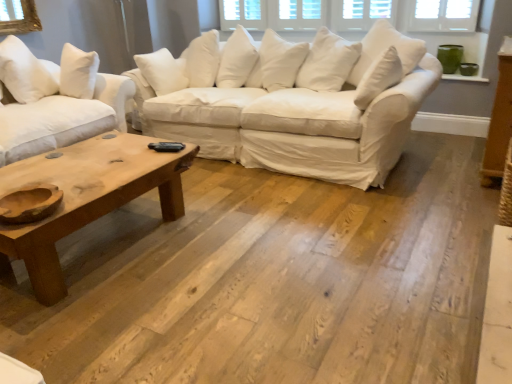
In order to face natural wood studio couch at left, which appears as the first studio couch when viewed from the left, should I rotate leftwards or rightwards?

It's best to rotate left around 27.192 degrees.

Identify the location of natural wood studio couch at left, which appears as the first studio couch when viewed from the left. This screenshot has width=512, height=384. (56, 100).

In order to click on white cotton pillow at upper left in this screenshot , I will do `click(26, 72)`.

Identify the location of natural wood studio couch at left, which appears as the first studio couch when viewed from the left. (56, 100).

Is natural wood studio couch at left, which appears as the first studio couch when viewed from the left, situated inside white cotton pillow at upper left or outside?

natural wood studio couch at left, which appears as the first studio couch when viewed from the left, lies outside white cotton pillow at upper left.

Looking at this image, are natural wood studio couch at left, positioned as the second studio couch in right-to-left order, and white cotton pillow at upper left far apart?

No, there isn't a large distance between natural wood studio couch at left, positioned as the second studio couch in right-to-left order, and white cotton pillow at upper left.

Which point is more forward, (41, 103) or (11, 43)?

The point (11, 43) is in front.

Is the depth of natural wood studio couch at left, which appears as the first studio couch when viewed from the left, greater than that of white cotton pillow at upper left?

No, natural wood studio couch at left, which appears as the first studio couch when viewed from the left, is in front of white cotton pillow at upper left.

Measure the distance from natural wood studio couch at left, which appears as the first studio couch when viewed from the left, to white cotton couch at center, acting as the 1th studio couch starting from the right.

natural wood studio couch at left, which appears as the first studio couch when viewed from the left, is 37.60 inches from white cotton couch at center, acting as the 1th studio couch starting from the right.

Which is in front, point (106, 113) or point (386, 22)?

Positioned in front is point (106, 113).

Are natural wood studio couch at left, positioned as the second studio couch in right-to-left order, and white cotton couch at center, acting as the 1th studio couch starting from the right, far apart?

No, there isn't a large distance between natural wood studio couch at left, positioned as the second studio couch in right-to-left order, and white cotton couch at center, acting as the 1th studio couch starting from the right.

Considering the sizes of objects natural wood studio couch at left, positioned as the second studio couch in right-to-left order, and white cotton couch at center, which is counted as the 2th studio couch, starting from the left, in the image provided, who is shorter, natural wood studio couch at left, positioned as the second studio couch in right-to-left order, or white cotton couch at center, which is counted as the 2th studio couch, starting from the left,?

white cotton couch at center, which is counted as the 2th studio couch, starting from the left, is shorter.

Which of these two, white cotton pillow at upper left or natural wood studio couch at left, which appears as the first studio couch when viewed from the left, is wider?

natural wood studio couch at left, which appears as the first studio couch when viewed from the left, is wider.

Choose the correct answer: Is white cotton pillow at upper left inside natural wood studio couch at left, positioned as the second studio couch in right-to-left order, or outside it?

white cotton pillow at upper left fits inside natural wood studio couch at left, positioned as the second studio couch in right-to-left order.

Is white cotton pillow at upper left aimed at natural wood studio couch at left, positioned as the second studio couch in right-to-left order?

Yes, white cotton pillow at upper left is facing natural wood studio couch at left, positioned as the second studio couch in right-to-left order.

Considering the positions of objects white cotton pillow at upper left and natural wood studio couch at left, which appears as the first studio couch when viewed from the left, in the image provided, who is more to the right, white cotton pillow at upper left or natural wood studio couch at left, which appears as the first studio couch when viewed from the left,?

natural wood studio couch at left, which appears as the first studio couch when viewed from the left.

Would you say white cotton pillow at upper left is part of natural wood coffee table at lower left's contents?

That's incorrect, white cotton pillow at upper left is not inside natural wood coffee table at lower left.

How different are the orientations of natural wood coffee table at lower left and white cotton pillow at upper left in degrees?

There is a 30.3-degree angle between the facing directions of natural wood coffee table at lower left and white cotton pillow at upper left.

Is natural wood coffee table at lower left oriented towards white cotton pillow at upper left?

No, natural wood coffee table at lower left does not turn towards white cotton pillow at upper left.

Considering the relative sizes of natural wood coffee table at lower left and white cotton pillow at upper left in the image provided, is natural wood coffee table at lower left thinner than white cotton pillow at upper left?

Incorrect, the width of natural wood coffee table at lower left is not less than that of white cotton pillow at upper left.

Is white cotton pillow at upper left oriented away from natural wood coffee table at lower left?

white cotton pillow at upper left does not have its back to natural wood coffee table at lower left.

From the image's perspective, is white cotton pillow at upper left below natural wood coffee table at lower left?

Actually, white cotton pillow at upper left appears above natural wood coffee table at lower left in the image.

In the scene shown: Is white cotton pillow at upper left positioned far away from natural wood coffee table at lower left?

white cotton pillow at upper left is positioned a significant distance from natural wood coffee table at lower left.

Between white cotton pillow at upper left and natural wood coffee table at lower left, which one appears on the left side from the viewer's perspective?

From the viewer's perspective, white cotton pillow at upper left appears more on the left side.

Considering the sizes of natural wood coffee table at lower left and white cotton couch at center, which is counted as the 2th studio couch, starting from the left, in the image, is natural wood coffee table at lower left wider or thinner than white cotton couch at center, which is counted as the 2th studio couch, starting from the left,?

Clearly, natural wood coffee table at lower left has less width compared to white cotton couch at center, which is counted as the 2th studio couch, starting from the left.

Is natural wood coffee table at lower left to the right of white cotton couch at center, acting as the 1th studio couch starting from the right, from the viewer's perspective?

In fact, natural wood coffee table at lower left is to the left of white cotton couch at center, acting as the 1th studio couch starting from the right.

Is the position of natural wood coffee table at lower left less distant than that of white cotton couch at center, acting as the 1th studio couch starting from the right?

Yes, natural wood coffee table at lower left is in front of white cotton couch at center, acting as the 1th studio couch starting from the right.

Which of these two, natural wood coffee table at lower left or white cotton couch at center, acting as the 1th studio couch starting from the right, stands shorter?

Standing shorter between the two is natural wood coffee table at lower left.

Is white cotton pillow at upper left far from white cotton couch at center, acting as the 1th studio couch starting from the right?

white cotton pillow at upper left is far away from white cotton couch at center, acting as the 1th studio couch starting from the right.

Is white cotton pillow at upper left wider than white cotton couch at center, acting as the 1th studio couch starting from the right?

No.

Is white cotton couch at center, acting as the 1th studio couch starting from the right, at the back of white cotton pillow at upper left?

white cotton pillow at upper left does not have its back to white cotton couch at center, acting as the 1th studio couch starting from the right.

Can you confirm if white cotton pillow at upper left is bigger than white cotton couch at center, which is counted as the 2th studio couch, starting from the left?

Incorrect, white cotton pillow at upper left is not larger than white cotton couch at center, which is counted as the 2th studio couch, starting from the left.

Where is `studio couch that is the 1st object to the right of the white cotton pillow at upper left, starting at the anchor`? Image resolution: width=512 pixels, height=384 pixels. studio couch that is the 1st object to the right of the white cotton pillow at upper left, starting at the anchor is located at coordinates (56, 100).

This screenshot has width=512, height=384. What are the coordinates of `studio couch on the left side of white cotton couch at center, acting as the 1th studio couch starting from the right` in the screenshot? It's located at (56, 100).

Looking at the image, which one is located closer to white cotton pillow at upper left, natural wood studio couch at left, positioned as the second studio couch in right-to-left order, or natural wood coffee table at lower left?

The object closer to white cotton pillow at upper left is natural wood studio couch at left, positioned as the second studio couch in right-to-left order.

From the image, which object appears to be farther from natural wood coffee table at lower left, white cotton pillow at upper left or white cotton couch at center, which is counted as the 2th studio couch, starting from the left?

The object further to natural wood coffee table at lower left is white cotton pillow at upper left.

When comparing their distances from white cotton couch at center, acting as the 1th studio couch starting from the right, does white cotton pillow at upper left or natural wood coffee table at lower left seem closer?

The object closer to white cotton couch at center, acting as the 1th studio couch starting from the right, is natural wood coffee table at lower left.

When comparing their distances from white cotton couch at center, which is counted as the 2th studio couch, starting from the left, does natural wood coffee table at lower left or white cotton pillow at upper left seem closer?

Based on the image, natural wood coffee table at lower left appears to be nearer to white cotton couch at center, which is counted as the 2th studio couch, starting from the left.

Based on the photo, when comparing their distances from white cotton pillow at upper left, does white cotton couch at center, which is counted as the 2th studio couch, starting from the left, or natural wood coffee table at lower left seem closer?

Based on the image, natural wood coffee table at lower left appears to be nearer to white cotton pillow at upper left.

Which object lies nearer to the anchor point white cotton couch at center, acting as the 1th studio couch starting from the right, natural wood studio couch at left, which appears as the first studio couch when viewed from the left, or white cotton pillow at upper left?

natural wood studio couch at left, which appears as the first studio couch when viewed from the left.

Looking at the image, which one is located further to white cotton couch at center, which is counted as the 2th studio couch, starting from the left, natural wood studio couch at left, positioned as the second studio couch in right-to-left order, or natural wood coffee table at lower left?

The object further to white cotton couch at center, which is counted as the 2th studio couch, starting from the left, is natural wood coffee table at lower left.

Estimate the real-world distances between objects in this image. Which object is further from natural wood studio couch at left, positioned as the second studio couch in right-to-left order, natural wood coffee table at lower left or white cotton pillow at upper left?

natural wood coffee table at lower left is positioned further to the anchor natural wood studio couch at left, positioned as the second studio couch in right-to-left order.

Find the location of a particular element. studio couch between white cotton pillow at upper left and white cotton couch at center, which is counted as the 2th studio couch, starting from the left, in the horizontal direction is located at coordinates (56, 100).

Where is `coffee table between natural wood studio couch at left, positioned as the second studio couch in right-to-left order, and white cotton couch at center, acting as the 1th studio couch starting from the right`? coffee table between natural wood studio couch at left, positioned as the second studio couch in right-to-left order, and white cotton couch at center, acting as the 1th studio couch starting from the right is located at coordinates (86, 198).

The image size is (512, 384). I want to click on coffee table situated between white cotton pillow at upper left and white cotton couch at center, acting as the 1th studio couch starting from the right, from left to right, so click(86, 198).